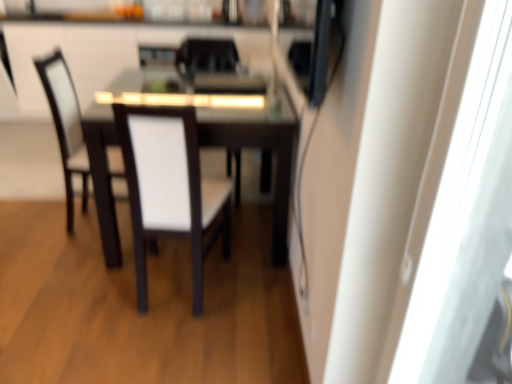
Question: From a real-world perspective, is white fabric chair at center, marked as the third chair in a back-to-front arrangement, above or below white glossy cabinetry at upper center?

Choices:
 (A) above
 (B) below

Answer: (A)

Question: Is point [75, 135] positioned closer to the camera than point [40, 39]?

Choices:
 (A) farther
 (B) closer

Answer: (B)

Question: Considering the real-world distances, which object is farthest from the dark wood table at center?

Choices:
 (A) white glossy cabinetry at upper center
 (B) white fabric chair at center, the fourth chair from the back
 (C) white fabric chair at center, marked as the third chair in a back-to-front arrangement
 (D) transparent plastic screen door at right
 (E) white fabric chair at center, acting as the third chair starting from the front

Answer: (A)

Question: Which is farther from the white fabric chair at center, acting as the fourth chair starting from the front?

Choices:
 (A) transparent plastic screen door at right
 (B) white fabric chair at center, the 2th chair when ordered from front to back
 (C) white fabric chair at center, which is counted as the second chair, starting from the back
 (D) white fabric chair at center, the fourth chair from the back
 (E) white glossy cabinetry at upper center

Answer: (A)